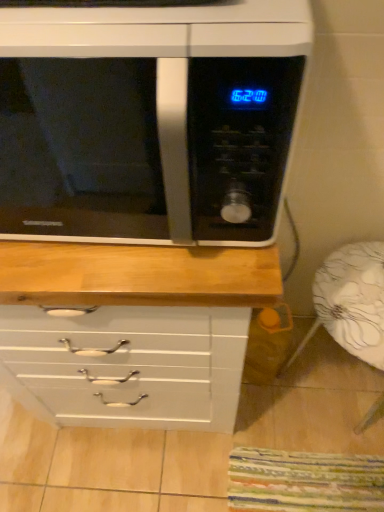
Consider the image. In order to face black glossy microwave at upper center, should I rotate leftwards or rightwards?

You should look left and rotate roughly 13.194 degrees.

What is the approximate width of black glossy microwave at upper center?

black glossy microwave at upper center is 17.09 inches in width.

This screenshot has width=384, height=512. Describe the element at coordinates (148, 119) in the screenshot. I see `black glossy microwave at upper center` at that location.

At what (x,y) coordinates should I click in order to perform the action: click on black glossy microwave at upper center. Please return your answer as a coordinate pair (x, y). This screenshot has width=384, height=512. Looking at the image, I should click on (148, 119).

At what (x,y) coordinates should I click in order to perform the action: click on white floral fabric armchair at lower right. Please return your answer as a coordinate pair (x, y). Looking at the image, I should click on (351, 302).

What do you see at coordinates (351, 302) in the screenshot? This screenshot has width=384, height=512. I see `white floral fabric armchair at lower right` at bounding box center [351, 302].

What is the approximate width of white floral fabric armchair at lower right?

white floral fabric armchair at lower right is 16.20 inches wide.

At what (x,y) coordinates should I click in order to perform the action: click on black glossy microwave at upper center. Please return your answer as a coordinate pair (x, y). This screenshot has width=384, height=512. Looking at the image, I should click on (148, 119).

Which object is positioned more to the right, white floral fabric armchair at lower right or black glossy microwave at upper center?

From the viewer's perspective, white floral fabric armchair at lower right appears more on the right side.

Which is in front, white floral fabric armchair at lower right or black glossy microwave at upper center?

black glossy microwave at upper center is more forward.

Between point (378, 312) and point (6, 114), which one is positioned behind?

Point (6, 114)

From the image's perspective, relative to black glossy microwave at upper center, is white floral fabric armchair at lower right above or below?

white floral fabric armchair at lower right is situated lower than black glossy microwave at upper center in the image.

From a real-world perspective, is white floral fabric armchair at lower right on black glossy microwave at upper center?

No, from a real-world perspective, white floral fabric armchair at lower right is not above black glossy microwave at upper center.

Is white floral fabric armchair at lower right wider or thinner than black glossy microwave at upper center?

Considering their sizes, white floral fabric armchair at lower right looks slimmer than black glossy microwave at upper center.

Which of these two, white floral fabric armchair at lower right or black glossy microwave at upper center, stands taller?

white floral fabric armchair at lower right.

Looking at the image, does white floral fabric armchair at lower right seem bigger or smaller compared to black glossy microwave at upper center?

white floral fabric armchair at lower right is bigger than black glossy microwave at upper center.

Is black glossy microwave at upper center located within white floral fabric armchair at lower right?

No, black glossy microwave at upper center is not a part of white floral fabric armchair at lower right.

Is white floral fabric armchair at lower right far from black glossy microwave at upper center?

Absolutely, white floral fabric armchair at lower right is distant from black glossy microwave at upper center.

Does white floral fabric armchair at lower right turn towards black glossy microwave at upper center?

No, white floral fabric armchair at lower right is not oriented towards black glossy microwave at upper center.

What's the angular difference between white floral fabric armchair at lower right and black glossy microwave at upper center's facing directions?

white floral fabric armchair at lower right and black glossy microwave at upper center are facing 1.06 degrees away from each other.

At what (x,y) coordinates should I click in order to perform the action: click on armchair located below the black glossy microwave at upper center (from the image's perspective). Please return your answer as a coordinate pair (x, y). This screenshot has height=512, width=384. Looking at the image, I should click on (351, 302).

Can you confirm if black glossy microwave at upper center is positioned to the left of white floral fabric armchair at lower right?

Yes, black glossy microwave at upper center is to the left of white floral fabric armchair at lower right.

Based on the photo, which object is more forward, black glossy microwave at upper center or white floral fabric armchair at lower right?

black glossy microwave at upper center is closer to the camera.

Is point (45, 25) positioned after point (331, 309)?

No, it is not.

From the image's perspective, which object appears higher, black glossy microwave at upper center or white floral fabric armchair at lower right?

black glossy microwave at upper center appears higher in the image.

From a real-world perspective, between black glossy microwave at upper center and white floral fabric armchair at lower right, who is vertically higher?

black glossy microwave at upper center is physically above.

In terms of width, does black glossy microwave at upper center look wider or thinner when compared to white floral fabric armchair at lower right?

In the image, black glossy microwave at upper center appears to be wider than white floral fabric armchair at lower right.

Is black glossy microwave at upper center taller or shorter than white floral fabric armchair at lower right?

In the image, black glossy microwave at upper center appears to be shorter than white floral fabric armchair at lower right.

Who is bigger, black glossy microwave at upper center or white floral fabric armchair at lower right?

With larger size is white floral fabric armchair at lower right.

Would you say black glossy microwave at upper center is outside white floral fabric armchair at lower right?

Yes, black glossy microwave at upper center is not within white floral fabric armchair at lower right.

Is black glossy microwave at upper center not close to white floral fabric armchair at lower right?

Yes, black glossy microwave at upper center is far from white floral fabric armchair at lower right.

Is black glossy microwave at upper center looking in the opposite direction of white floral fabric armchair at lower right?

No, black glossy microwave at upper center is not facing away from white floral fabric armchair at lower right.

Measure the distance between black glossy microwave at upper center and white floral fabric armchair at lower right.

black glossy microwave at upper center and white floral fabric armchair at lower right are 3.37 feet apart.

You are a GUI agent. You are given a task and a screenshot of the screen. Output one action in this format:
    pyautogui.click(x=<x>, y=<y>)
    Task: Click on the armchair that is behind the black glossy microwave at upper center
    
    Given the screenshot: What is the action you would take?
    pyautogui.click(x=351, y=302)

In order to click on armchair behind the black glossy microwave at upper center in this screenshot , I will do `click(351, 302)`.

You are a GUI agent. You are given a task and a screenshot of the screen. Output one action in this format:
    pyautogui.click(x=<x>, y=<y>)
    Task: Click on the armchair below the black glossy microwave at upper center (from the image's perspective)
    The width and height of the screenshot is (384, 512).
    Given the screenshot: What is the action you would take?
    pyautogui.click(x=351, y=302)